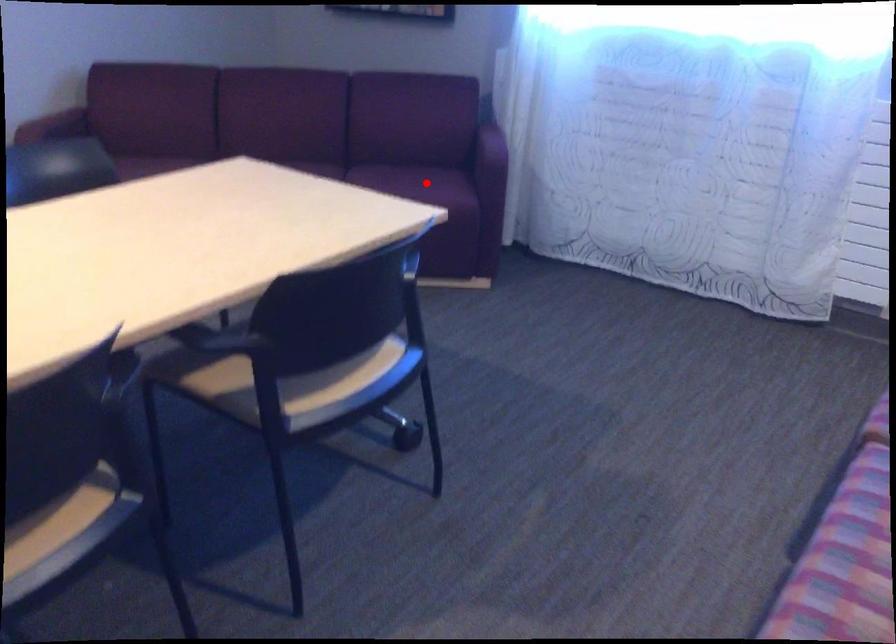
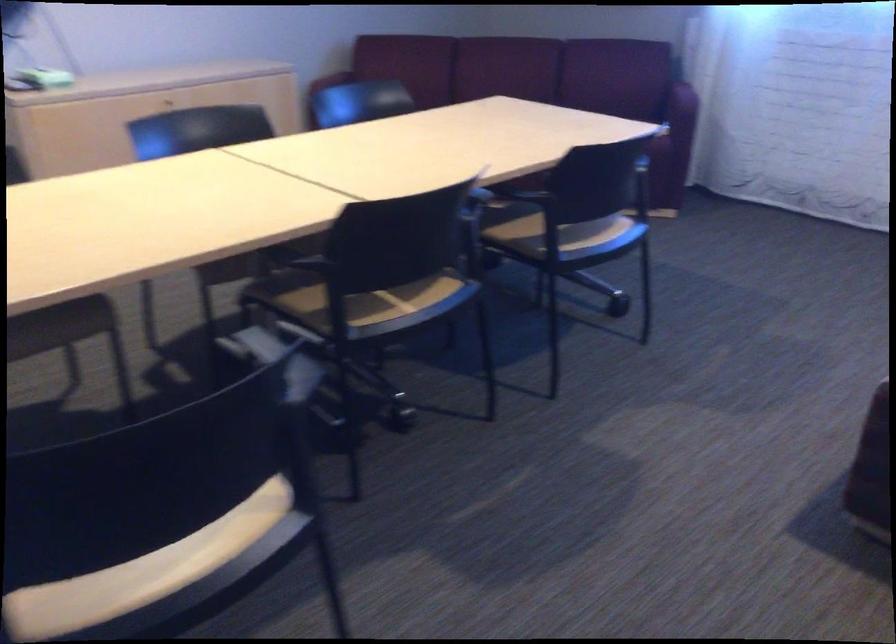
Question: I am providing you with two images of the same scene from different viewpoints. A red point is marked on the first image. Is the red point's position out of view in image 2?

Choices:
 (A) Yes
 (B) No

Answer: (A)